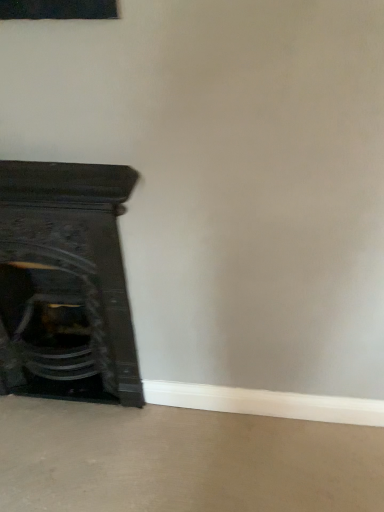
What do you see at coordinates (65, 283) in the screenshot?
I see `black cast iron fireplace at left` at bounding box center [65, 283].

The width and height of the screenshot is (384, 512). What are the coordinates of `black cast iron fireplace at left` in the screenshot? It's located at (65, 283).

You are a GUI agent. You are given a task and a screenshot of the screen. Output one action in this format:
    pyautogui.click(x=<x>, y=<y>)
    Task: Click on the black cast iron fireplace at left
    
    Given the screenshot: What is the action you would take?
    pyautogui.click(x=65, y=283)